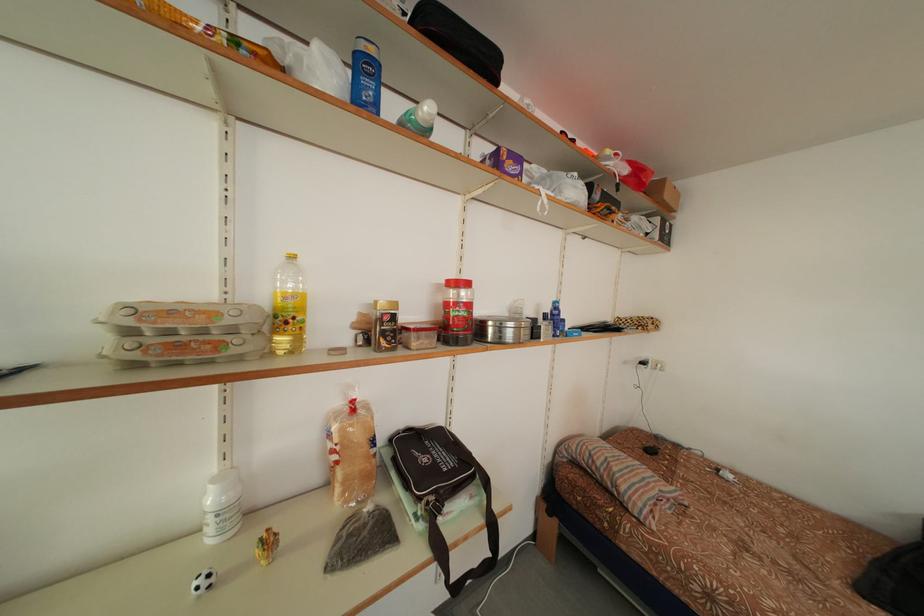
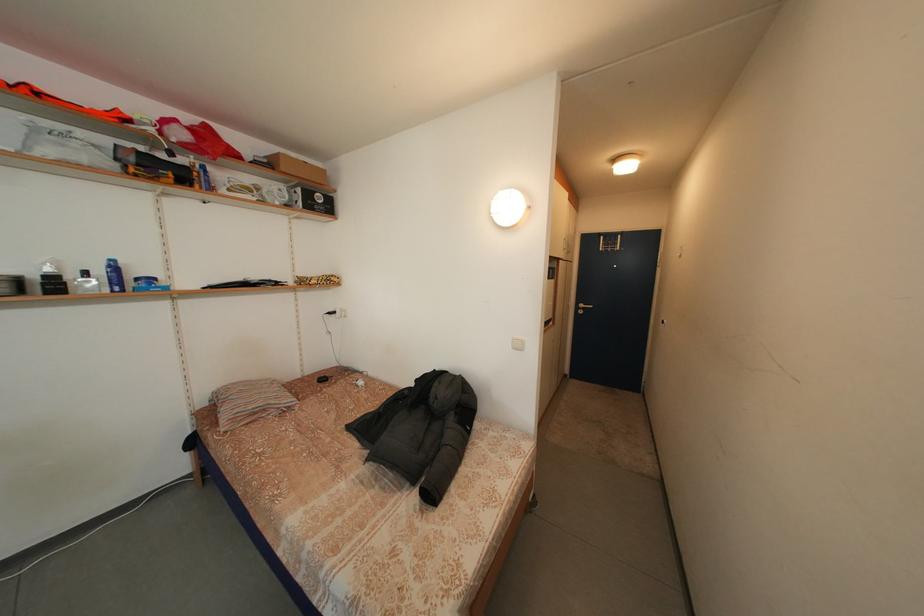
Question: I am providing you with two images of the same scene from different viewpoints. Please identify which objects are invisible in image2.

Choices:
 (A) striped pillow
 (B) black and yellow level
 (C) white light switch
 (D) none of these

Answer: (D)